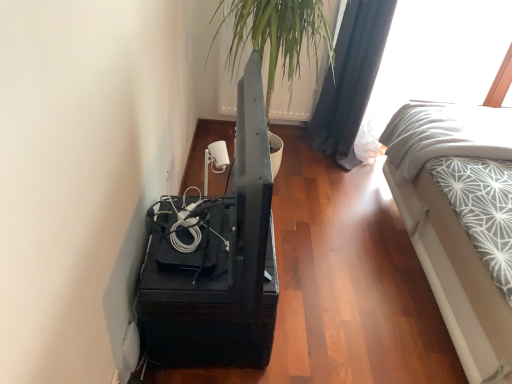
Question: From a real-world perspective, does transparent glass window at upper right sit lower than white textured bed at right?

Choices:
 (A) no
 (B) yes

Answer: (A)

Question: From the image's perspective, is transparent glass window at upper right beneath white textured bed at right?

Choices:
 (A) yes
 (B) no

Answer: (B)

Question: Does transparent glass window at upper right contain white textured bed at right?

Choices:
 (A) no
 (B) yes

Answer: (A)

Question: From the image's perspective, is transparent glass window at upper right on white textured bed at right?

Choices:
 (A) yes
 (B) no

Answer: (A)

Question: Can you confirm if transparent glass window at upper right is positioned to the left of white textured bed at right?

Choices:
 (A) no
 (B) yes

Answer: (B)

Question: Is transparent glass window at upper right thinner than white textured bed at right?

Choices:
 (A) yes
 (B) no

Answer: (A)

Question: Is the position of black matte tv stand at lower left more distant than that of black fabric curtain at upper right?

Choices:
 (A) yes
 (B) no

Answer: (B)

Question: From a real-world perspective, is black matte tv stand at lower left positioned over black fabric curtain at upper right based on gravity?

Choices:
 (A) no
 (B) yes

Answer: (A)

Question: Is black matte tv stand at lower left wider than black fabric curtain at upper right?

Choices:
 (A) no
 (B) yes

Answer: (B)

Question: Could black fabric curtain at upper right be considered to be inside black matte tv stand at lower left?

Choices:
 (A) no
 (B) yes

Answer: (A)

Question: Are black matte tv stand at lower left and black fabric curtain at upper right far apart?

Choices:
 (A) yes
 (B) no

Answer: (A)

Question: From the image's perspective, does black matte tv stand at lower left appear lower than black fabric curtain at upper right?

Choices:
 (A) no
 (B) yes

Answer: (B)

Question: Does white textured fabric at right have a larger size compared to green leafy plant at upper center?

Choices:
 (A) no
 (B) yes

Answer: (A)